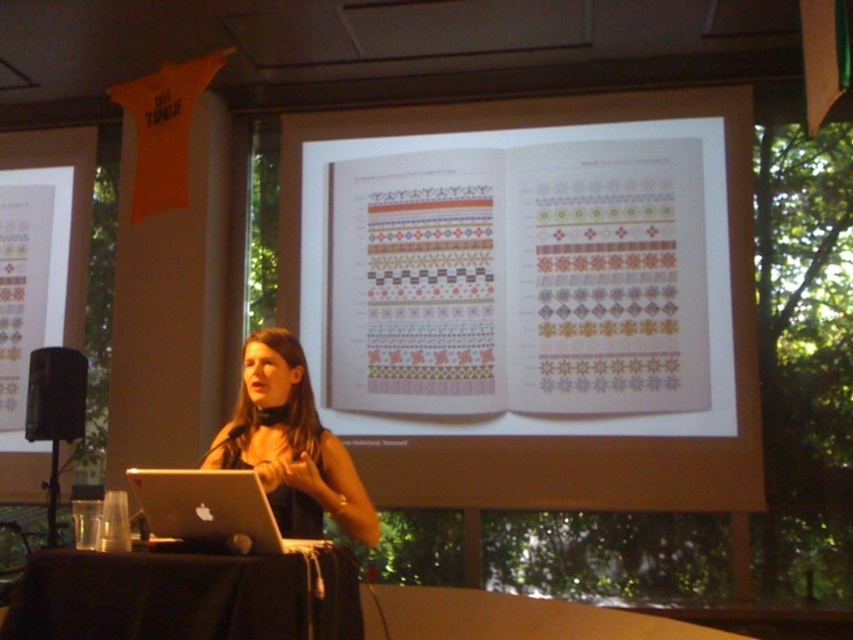
From the picture: You are organizing a presentation and want to place your laptop closer to the center of the table. Currently, the silver metallic laptop at lower left is positioned to the right of the black fabric table at lower center. Can you move it to the left side of the table?

The silver metallic laptop at lower left is currently to the right of the black fabric table at lower center. To move it to the left side of the table, you would need to shift it from its current position on the right to the left side of the black fabric table at lower center.

You are standing in the presentation room and want to place a 2 feet wide laptop on the black fabric table at lower center. Can the laptop fit on the table?

The black fabric table at lower center is 6.28 feet away from the viewer. The question about the laptop fitting cannot be determined based on the provided information as the table dimensions are not specified.

You are an attendee at the presentation and want to know which of the two points, point [251,600] or point [160,528], is closer to the presenter. Based on their positions, which point is in front of the other?

Point [251,600] is in front of point [160,528], so it is closer to the presenter.